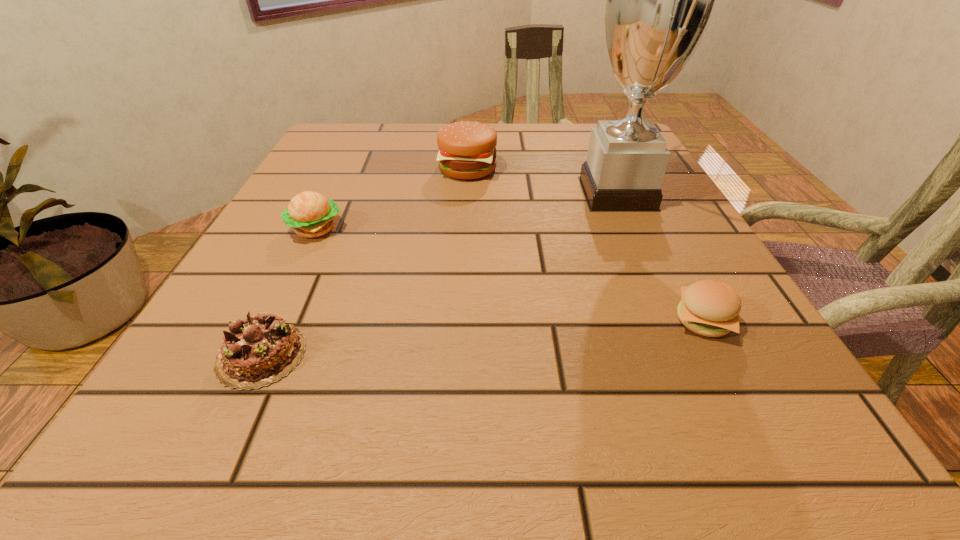
This screenshot has height=540, width=960. Find the location of `free region located 0.240m on the right of the leftmost hamburger`. free region located 0.240m on the right of the leftmost hamburger is located at coordinates (473, 229).

Identify the location of free space located 0.140m on the left of the nearest hamburger. (574, 321).

At what (x,y) coordinates should I click in order to perform the action: click on blank space located 0.170m on the back of the shortest object. Please return your answer as a coordinate pair (x, y). This screenshot has height=540, width=960. Looking at the image, I should click on (310, 251).

Locate an element on the screen. trophy cup present at the far edge is located at coordinates (660, 0).

I want to click on hamburger that is positioned at the far edge, so click(467, 150).

Find the location of a particular element. This screenshot has width=960, height=540. hamburger present at the left edge is located at coordinates (x=311, y=214).

This screenshot has height=540, width=960. What are the coordinates of `chocolate cake at the left edge` in the screenshot? It's located at (257, 351).

The height and width of the screenshot is (540, 960). Find the location of `trophy cup that is at the right edge`. trophy cup that is at the right edge is located at coordinates (660, 0).

You are a GUI agent. You are given a task and a screenshot of the screen. Output one action in this format:
    pyautogui.click(x=<x>, y=<y>)
    Task: Click on the hamburger that is at the right edge
    
    Given the screenshot: What is the action you would take?
    pyautogui.click(x=710, y=308)

Identify the location of object located at the far right corner. click(660, 0).